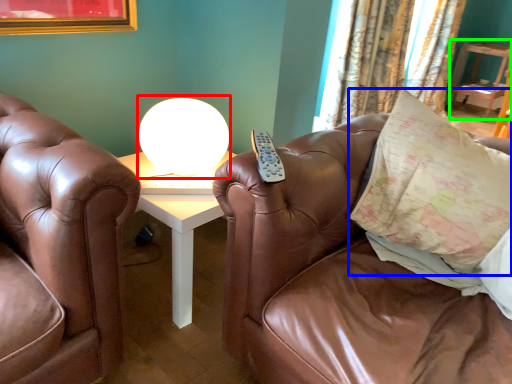
Question: Which is farther away from table lamp (highlighted by a red box)? pillow (highlighted by a blue box) or table (highlighted by a green box)?

Choices:
 (A) pillow
 (B) table

Answer: (B)